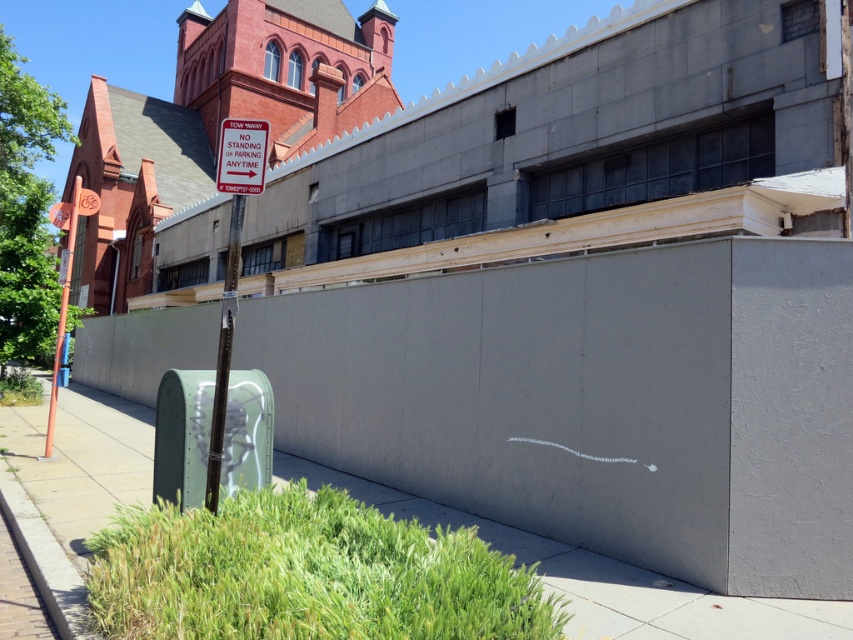
Can you confirm if red plastic sign at upper left is positioned to the right of orange plastic sign at left?

Correct, you'll find red plastic sign at upper left to the right of orange plastic sign at left.

Between red plastic sign at upper left and orange plastic sign at left, which one is positioned higher?

orange plastic sign at left

At what (x,y) coordinates should I click in order to perform the action: click on red plastic sign at upper left. Please return your answer as a coordinate pair (x, y). Looking at the image, I should click on point(241,156).

Is smooth concrete pavement at lower center above orange plastic sign at left?

Incorrect, smooth concrete pavement at lower center is not positioned above orange plastic sign at left.

Is smooth concrete pavement at lower center further to camera compared to orange plastic sign at left?

No, it is not.

Identify the location of smooth concrete pavement at lower center. The image size is (853, 640). (607, 579).

How distant is brick church at upper left from orange plastic sign at left?

A distance of 11.22 meters exists between brick church at upper left and orange plastic sign at left.

Which of these two, brick church at upper left or orange plastic sign at left, stands shorter?

orange plastic sign at left

Does point (270, 68) lie behind point (64, 292)?

That is True.

In order to click on brick church at upper left in this screenshot , I will do `click(218, 120)`.